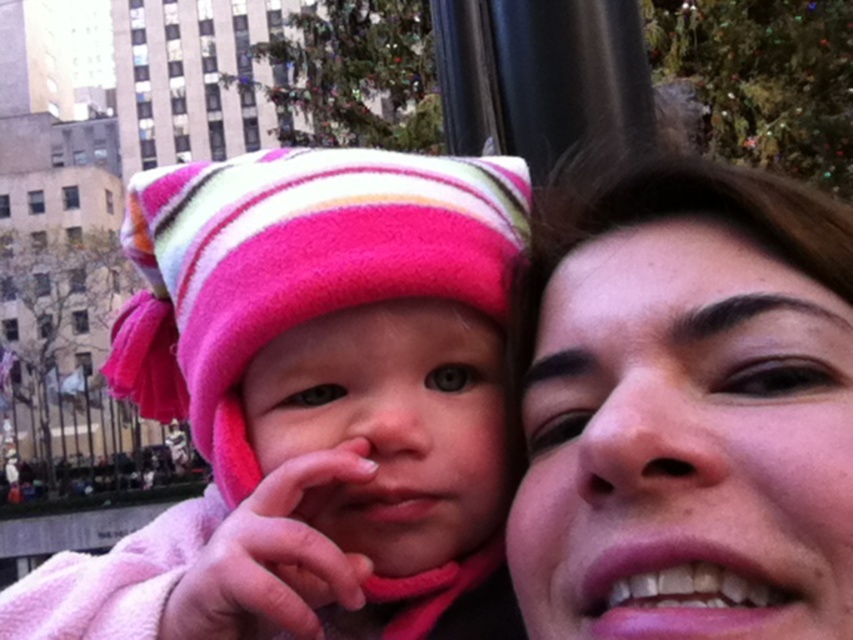
Question: Where is matte fleece hat at left located in relation to smooth skin face at right in the image?

Choices:
 (A) left
 (B) right

Answer: (A)

Question: Does matte fleece hat at left have a lesser width compared to smooth skin face at right?

Choices:
 (A) no
 (B) yes

Answer: (A)

Question: Is the position of matte fleece hat at left less distant than that of smooth skin face at right?

Choices:
 (A) yes
 (B) no

Answer: (A)